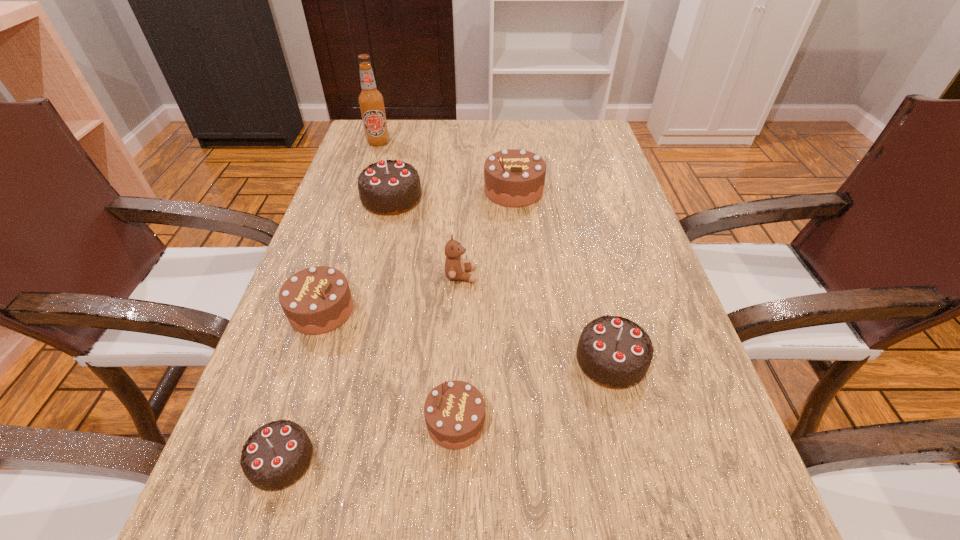
At what (x,y) coordinates should I click in order to perform the action: click on the farthest object. Please return your answer as a coordinate pair (x, y). The width and height of the screenshot is (960, 540). Looking at the image, I should click on (371, 101).

I want to click on beer bottle, so click(x=371, y=101).

I want to click on the second object from right to left, so click(x=513, y=178).

This screenshot has height=540, width=960. What are the coordinates of `the biggest brown chocolate cake` in the screenshot? It's located at (513, 178).

Where is `the biggest chocolate chocolate cake`? Image resolution: width=960 pixels, height=540 pixels. the biggest chocolate chocolate cake is located at coordinates (390, 187).

Find the location of a particular element. Image resolution: width=960 pixels, height=540 pixels. brown teddy bear is located at coordinates (455, 269).

I want to click on the second nearest brown chocolate cake, so click(316, 300).

Identify the location of the second biggest brown chocolate cake. (316, 300).

Image resolution: width=960 pixels, height=540 pixels. I want to click on the rightmost chocolate cake, so (614, 352).

Where is `the second nearest chocolate chocolate cake`? This screenshot has height=540, width=960. the second nearest chocolate chocolate cake is located at coordinates (614, 352).